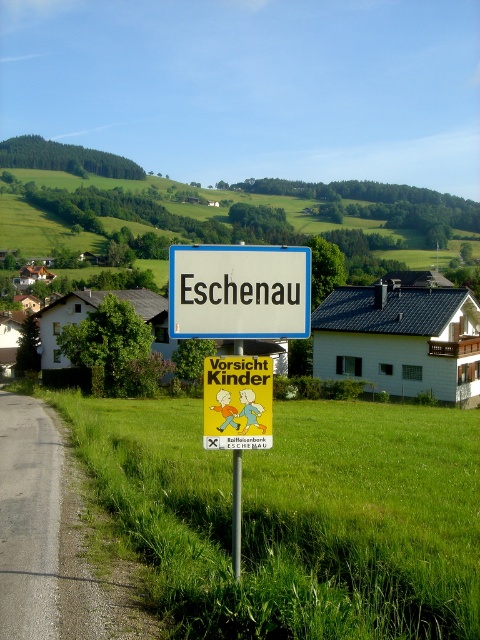
You are standing at the signpost near the road in the rural landscape. You see a point marked at coordinates point (295, 516). Can you determine if this point is located on the green grass at lower center?

The point (295, 516) is on green grass at lower center, so yes, the point is located there.

You are a delivery driver navigating through Eschenau and need to locate the white plastic sign at center. According to the map, this sign is at coordinates point [239,291]. Is the white plastic sign at center located near the road or in the field?

The point [239,291] corresponds to the white plastic sign at center, so it is located near the road.